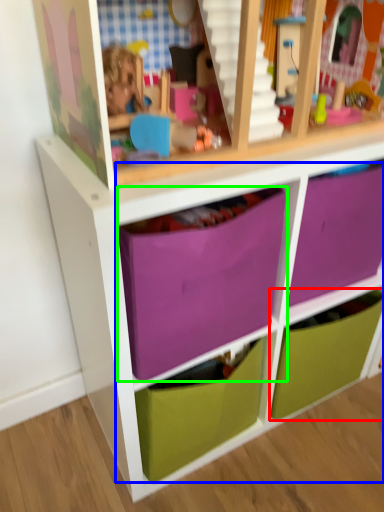
Question: Considering the real-world distances, which object is farthest from drawer (highlighted by a red box)? drawer (highlighted by a blue box) or drawer (highlighted by a green box)?

Choices:
 (A) drawer
 (B) drawer

Answer: (B)